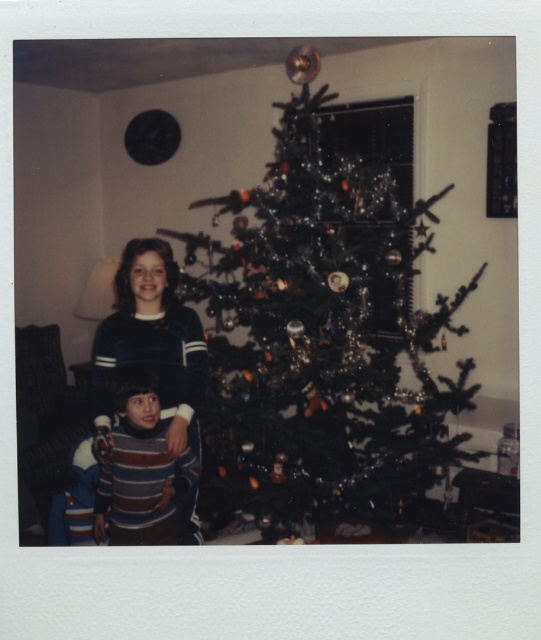
Question: Considering the real-world distances, which object is closest to the striped sweater at lower left?

Choices:
 (A) blue striped sweater at left
 (B) green shiny christmas tree at center

Answer: (A)

Question: Does blue striped sweater at left come in front of striped sweater at lower left?

Choices:
 (A) yes
 (B) no

Answer: (B)

Question: Is green shiny christmas tree at center above striped sweater at lower left?

Choices:
 (A) no
 (B) yes

Answer: (B)

Question: Which object is the farthest from the striped sweater at lower left?

Choices:
 (A) blue striped sweater at left
 (B) green shiny christmas tree at center

Answer: (B)

Question: From the image, what is the correct spatial relationship of green shiny christmas tree at center in relation to blue striped sweater at left?

Choices:
 (A) left
 (B) right

Answer: (B)

Question: Which point appears closest to the camera in this image?

Choices:
 (A) pyautogui.click(x=163, y=515)
 (B) pyautogui.click(x=154, y=358)

Answer: (A)